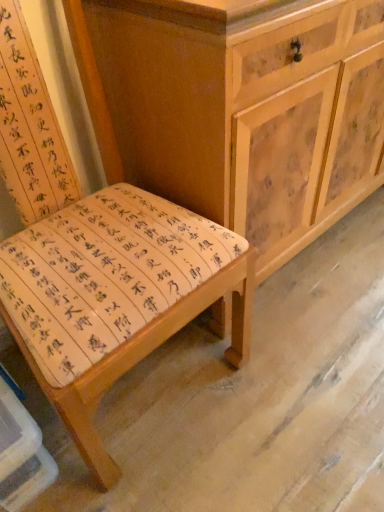
Locate an element on the screen. This screenshot has height=512, width=384. free space on the front side of wooden cabinet at center is located at coordinates (303, 361).